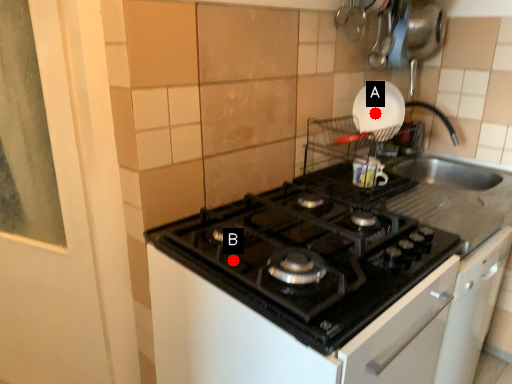
Question: Two points are circled on the image, labeled by A and B beside each circle. Which point appears closest to the camera in this image?

Choices:
 (A) A is closer
 (B) B is closer

Answer: (B)